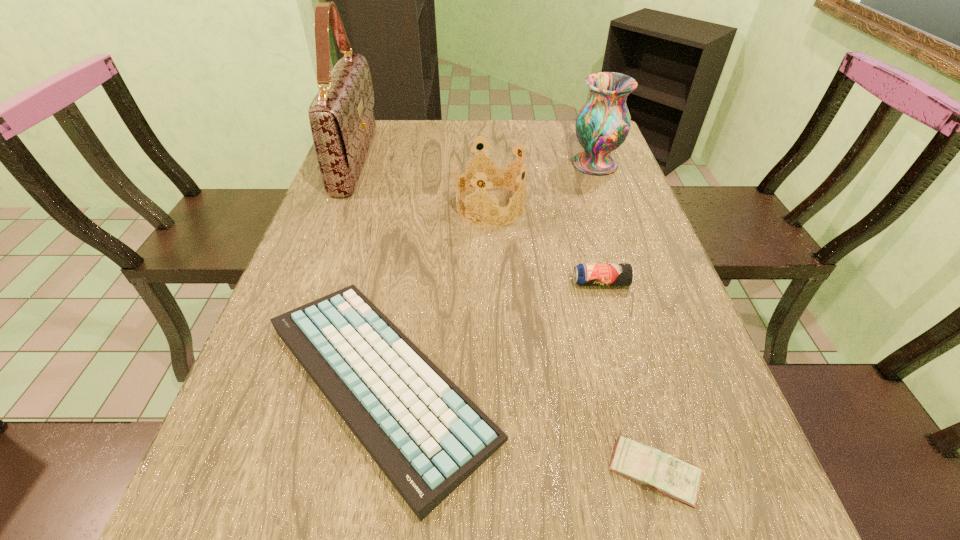
Locate an element on the screen. The image size is (960, 540). free space between the computer keyboard and the vase is located at coordinates (488, 273).

Where is `empty space between the crown and the diary`? The image size is (960, 540). empty space between the crown and the diary is located at coordinates (572, 339).

You are a GUI agent. You are given a task and a screenshot of the screen. Output one action in this format:
    pyautogui.click(x=<x>, y=<y>)
    Task: Click on the vacant area between the computer keyboard and the tallest object
    This screenshot has height=540, width=960.
    Given the screenshot: What is the action you would take?
    pyautogui.click(x=369, y=271)

Locate an element on the screen. This screenshot has height=540, width=960. vacant area that lies between the tallest object and the computer keyboard is located at coordinates (369, 271).

Identify which object is the second nearest to the computer keyboard. Please provide its 2D coordinates. Your answer should be formatted as a tuple, i.e. [(x, y)], where the tuple contains the x and y coordinates of a point satisfying the conditions above.

[(584, 274)]

Select which object is the closest to the shortest object. Please provide its 2D coordinates. Your answer should be formatted as a tuple, i.e. [(x, y)], where the tuple contains the x and y coordinates of a point satisfying the conditions above.

[(427, 436)]

The width and height of the screenshot is (960, 540). I want to click on vacant space that satisfies the following two spatial constraints: 1. on the back side of the vase; 2. on the left side of the third tallest object, so click(490, 164).

At what (x,y) coordinates should I click in order to perform the action: click on free location that satisfies the following two spatial constraints: 1. on the front of the tallest object with the clasp; 2. on the back side of the computer keyboard. Please return your answer as a coordinate pair (x, y). Image resolution: width=960 pixels, height=540 pixels. Looking at the image, I should click on (272, 381).

At what (x,y) coordinates should I click in order to perform the action: click on vacant space that satisfies the following two spatial constraints: 1. on the front of the tallest object with the clasp; 2. on the back side of the vase. Please return your answer as a coordinate pair (x, y). This screenshot has height=540, width=960. Looking at the image, I should click on (354, 164).

Locate an element on the screen. The height and width of the screenshot is (540, 960). vacant space that satisfies the following two spatial constraints: 1. on the front of the handbag with the clasp; 2. on the right side of the beer can is located at coordinates click(309, 282).